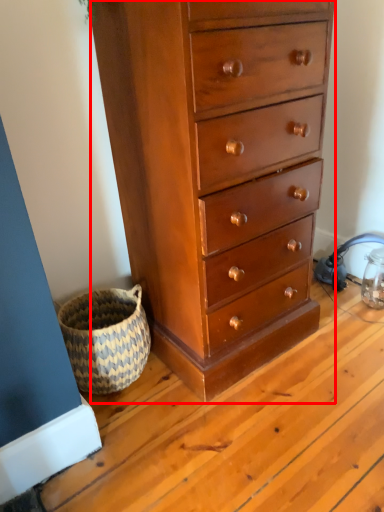
Question: From the image's perspective, where is chest of drawers (annotated by the red box) located in relation to basket in the image?

Choices:
 (A) below
 (B) above

Answer: (B)